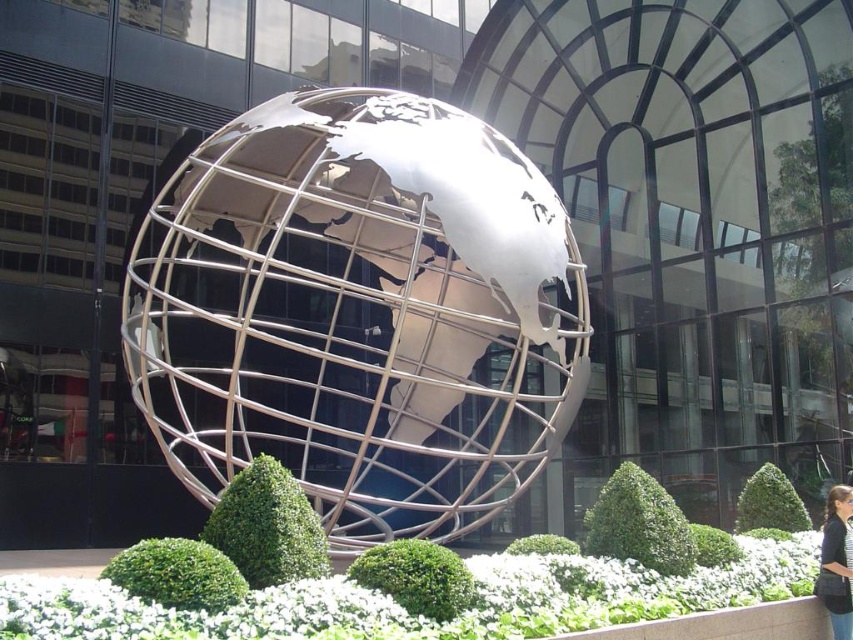
Question: Which point is farther from the camera taking this photo?

Choices:
 (A) 834,588
 (B) 448,227

Answer: (A)

Question: Where is metallic silver globe at center located in relation to black fabric hair at lower right in the image?

Choices:
 (A) above
 (B) below

Answer: (A)

Question: Does metallic silver globe at center lie behind black fabric hair at lower right?

Choices:
 (A) no
 (B) yes

Answer: (A)

Question: Is metallic silver globe at center to the left of black fabric hair at lower right from the viewer's perspective?

Choices:
 (A) yes
 (B) no

Answer: (A)

Question: Which point is farther to the camera?

Choices:
 (A) (383, 412)
 (B) (837, 550)

Answer: (A)